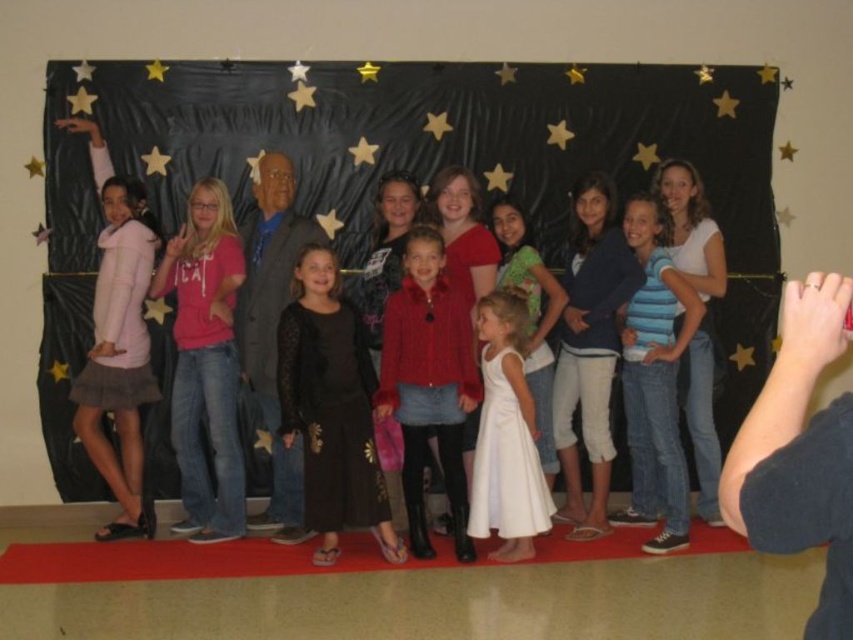
You are standing in the center of the group photo setup. You need to place a small decoration between the two points labeled point (437, 333) and point (663, 410). According to the scene description, which point should the decoration be closer to?

The decoration should be placed closer to point (437, 333) because it is in front of point (663, 410).

You are standing in front of the group and want to take a photo. Which of the two, the blue striped shirt at center or the white satin dress at center, is closer to you?

The blue striped shirt at center is closer to you because it is further to the viewer than the white satin dress at center.